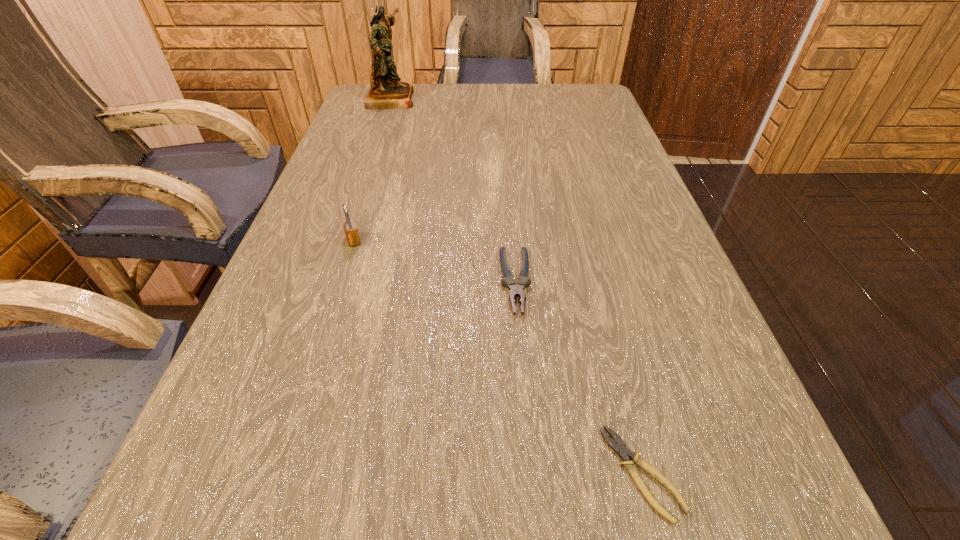
Identify the location of free region at the far right corner of the desktop. The width and height of the screenshot is (960, 540). (x=560, y=105).

The image size is (960, 540). Identify the location of free spot between the second object from right to left and the farthest object. (453, 190).

The height and width of the screenshot is (540, 960). Identify the location of vacant point located between the tallest object and the farther pliers. (453, 190).

The height and width of the screenshot is (540, 960). I want to click on unoccupied area between the farthest object and the second tallest object, so click(372, 169).

Identify the location of empty space that is in between the second farthest object and the left pliers. The height and width of the screenshot is (540, 960). (434, 261).

This screenshot has width=960, height=540. Identify the location of free spot between the rightmost object and the padlock. (497, 356).

Image resolution: width=960 pixels, height=540 pixels. I want to click on empty space that is in between the figurine and the taller pliers, so click(453, 190).

This screenshot has height=540, width=960. In order to click on unoccupied position between the nearest object and the third shortest object in this screenshot , I will do `click(497, 356)`.

I want to click on object that stands as the third closest to the tallest object, so click(x=620, y=447).

Image resolution: width=960 pixels, height=540 pixels. I want to click on the closest object to the left pliers, so click(620, 447).